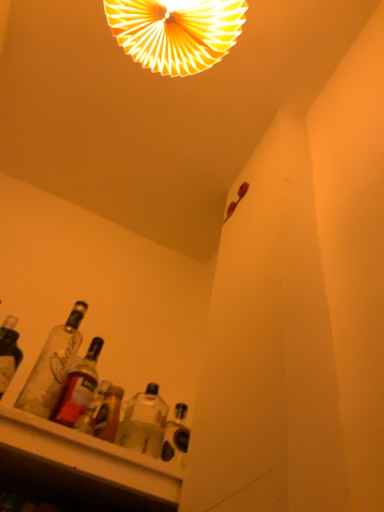
This screenshot has height=512, width=384. I want to click on translucent glass bottle at lower left, which is the second bottle in left-to-right order, so click(78, 387).

Is translucent glass bottle at lower left, which is the second bottle in left-to-right order, turned away from clear glass bottles at lower left, the 1th bottle positioned from the left?

No.

The image size is (384, 512). Identify the location of bottle that appears in front of the translucent glass bottle at lower left, which is counted as the 1th bottle, starting from the right. (52, 366).

Is point (88, 371) closer or farther from the camera than point (56, 337)?

Point (88, 371) is positioned farther from the camera compared to point (56, 337).

Can you confirm if translucent glass bottle at lower left, which is counted as the 1th bottle, starting from the right, is taller than clear glass bottles at lower left, the second bottle when ordered from right to left?

No.

How distant is clear glass bottles at lower left, the 1th bottle positioned from the left, from translucent glass bottle at lower left, which is the second bottle in left-to-right order?

clear glass bottles at lower left, the 1th bottle positioned from the left, and translucent glass bottle at lower left, which is the second bottle in left-to-right order, are 2.63 inches apart from each other.

How many degrees apart are the facing directions of clear glass bottles at lower left, the 1th bottle positioned from the left, and translucent glass bottle at lower left, which is counted as the 1th bottle, starting from the right?

The angular difference between clear glass bottles at lower left, the 1th bottle positioned from the left, and translucent glass bottle at lower left, which is counted as the 1th bottle, starting from the right, is 0.0061 degrees.

Considering the sizes of clear glass bottles at lower left, the second bottle when ordered from right to left, and translucent glass bottle at lower left, which is the second bottle in left-to-right order, in the image, is clear glass bottles at lower left, the second bottle when ordered from right to left, taller or shorter than translucent glass bottle at lower left, which is the second bottle in left-to-right order,?

In the image, clear glass bottles at lower left, the second bottle when ordered from right to left, appears to be taller than translucent glass bottle at lower left, which is the second bottle in left-to-right order.

Is clear glass bottles at lower left, the second bottle when ordered from right to left, facing away from translucent glass bottle at lower left, which is counted as the 1th bottle, starting from the right?

No, clear glass bottles at lower left, the second bottle when ordered from right to left, is not facing away from translucent glass bottle at lower left, which is counted as the 1th bottle, starting from the right.

Does clear glass bottles at lower left, the second bottle when ordered from right to left, have a greater height compared to white paper fan at upper center?

No.

Considering the relative sizes of clear glass bottles at lower left, the 1th bottle positioned from the left, and white paper fan at upper center in the image provided, is clear glass bottles at lower left, the 1th bottle positioned from the left, bigger than white paper fan at upper center?

Actually, clear glass bottles at lower left, the 1th bottle positioned from the left, might be smaller than white paper fan at upper center.

Is white paper fan at upper center inside clear glass bottles at lower left, the 1th bottle positioned from the left?

No.

Relative to white paper fan at upper center, is clear glass bottles at lower left, the 1th bottle positioned from the left, in front or behind?

Clearly, clear glass bottles at lower left, the 1th bottle positioned from the left, is in front of white paper fan at upper center.

From a real-world perspective, is translucent glass bottle at lower left, which is counted as the 1th bottle, starting from the right, physically located above or below white paper fan at upper center?

translucent glass bottle at lower left, which is counted as the 1th bottle, starting from the right, is below white paper fan at upper center.

From the image's perspective, does translucent glass bottle at lower left, which is the second bottle in left-to-right order, appear higher than white paper fan at upper center?

No, from the image's perspective, translucent glass bottle at lower left, which is the second bottle in left-to-right order, is not on top of white paper fan at upper center.

Is translucent glass bottle at lower left, which is counted as the 1th bottle, starting from the right, positioned far away from white paper fan at upper center?

No.

Is point (91, 344) positioned behind point (201, 36)?

That is True.

Which is more to the left, white paper fan at upper center or translucent glass bottle at lower left, which is the second bottle in left-to-right order?

From the viewer's perspective, translucent glass bottle at lower left, which is the second bottle in left-to-right order, appears more on the left side.

Does white paper fan at upper center come in front of translucent glass bottle at lower left, which is the second bottle in left-to-right order?

No, the depth of white paper fan at upper center is greater than that of translucent glass bottle at lower left, which is the second bottle in left-to-right order.

Consider the image. How far apart are white paper fan at upper center and translucent glass bottle at lower left, which is counted as the 1th bottle, starting from the right?

They are 83.09 centimeters apart.

Is translucent glass bottle at lower left, which is the second bottle in left-to-right order, a part of white paper fan at upper center?

No, white paper fan at upper center does not contain translucent glass bottle at lower left, which is the second bottle in left-to-right order.

From the image's perspective, which is above, white paper fan at upper center or clear glass bottles at lower left, the second bottle when ordered from right to left?

white paper fan at upper center is shown above in the image.

In the image, is white paper fan at upper center positioned in front of or behind clear glass bottles at lower left, the second bottle when ordered from right to left?

white paper fan at upper center is positioned farther from the viewer than clear glass bottles at lower left, the second bottle when ordered from right to left.

The image size is (384, 512). Identify the location of lamp on the right of clear glass bottles at lower left, the 1th bottle positioned from the left. (176, 32).

Consider the image. Which object is positioned more to the left, white paper fan at upper center or clear glass bottles at lower left, the 1th bottle positioned from the left?

Positioned to the left is clear glass bottles at lower left, the 1th bottle positioned from the left.

This screenshot has width=384, height=512. I want to click on bottle on the left of translucent glass bottle at lower left, which is the second bottle in left-to-right order, so click(x=52, y=366).

At what (x,y) coordinates should I click in order to perform the action: click on bottle lying above the translucent glass bottle at lower left, which is counted as the 1th bottle, starting from the right (from the image's perspective). Please return your answer as a coordinate pair (x, y). Looking at the image, I should click on (52, 366).

Based on their spatial positions, is white paper fan at upper center or clear glass bottles at lower left, the 1th bottle positioned from the left, further from translucent glass bottle at lower left, which is the second bottle in left-to-right order?

Based on the image, white paper fan at upper center appears to be further to translucent glass bottle at lower left, which is the second bottle in left-to-right order.

When comparing their distances from translucent glass bottle at lower left, which is counted as the 1th bottle, starting from the right, does clear glass bottles at lower left, the second bottle when ordered from right to left, or white paper fan at upper center seem further?

white paper fan at upper center is positioned further to the anchor translucent glass bottle at lower left, which is counted as the 1th bottle, starting from the right.

Considering their positions, is translucent glass bottle at lower left, which is the second bottle in left-to-right order, positioned further to clear glass bottles at lower left, the 1th bottle positioned from the left, than white paper fan at upper center?

white paper fan at upper center.

Estimate the real-world distances between objects in this image. Which object is closer to white paper fan at upper center, clear glass bottles at lower left, the 1th bottle positioned from the left, or translucent glass bottle at lower left, which is counted as the 1th bottle, starting from the right?

clear glass bottles at lower left, the 1th bottle positioned from the left.

Which object lies nearer to the anchor point white paper fan at upper center, translucent glass bottle at lower left, which is counted as the 1th bottle, starting from the right, or clear glass bottles at lower left, the 1th bottle positioned from the left?

The object closer to white paper fan at upper center is clear glass bottles at lower left, the 1th bottle positioned from the left.

Considering their positions, is white paper fan at upper center positioned further to clear glass bottles at lower left, the 1th bottle positioned from the left, than translucent glass bottle at lower left, which is counted as the 1th bottle, starting from the right?

white paper fan at upper center lies further to clear glass bottles at lower left, the 1th bottle positioned from the left, than the other object.

Find the location of a particular element. The image size is (384, 512). bottle between white paper fan at upper center and translucent glass bottle at lower left, which is the second bottle in left-to-right order, vertically is located at coordinates (52, 366).